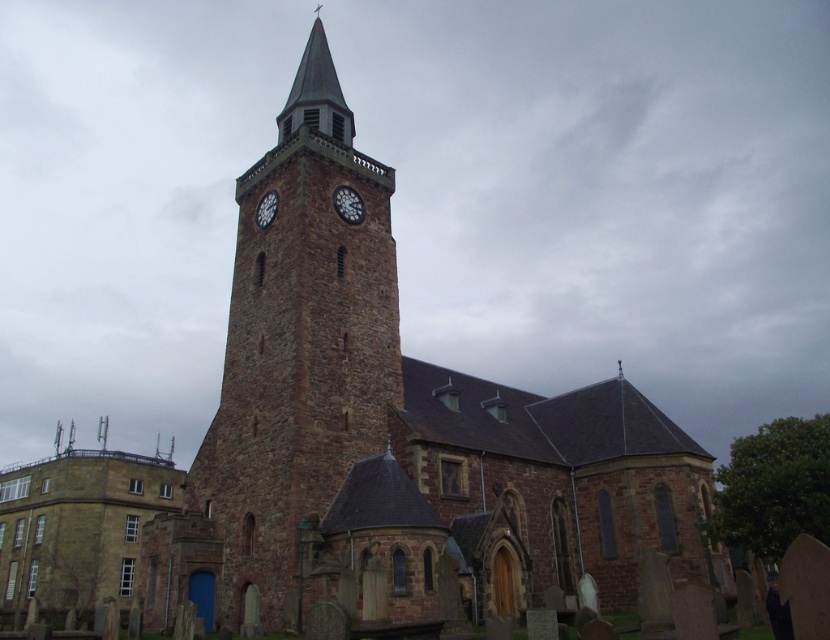
Looking at this image, you are standing in front of the historic stone church and want to take a photo that includes both the brown stone church at center and the brown stone clock tower at center. Which one should you zoom out more to include in the frame?

You should zoom out more to include the brown stone church at center because it has a larger size compared to the brown stone clock tower at center.

You are standing in front of the historic stone church and notice two clocks. The dark brown wooden clock at center and the matte brown clock at upper center. Which clock is positioned to the right of the other?

The dark brown wooden clock at center is to the right of the matte brown clock at upper center.

Based on the photo, you are standing in front of the historic stone church and want to take a photo of both point (570, 460) and point (340, 244) in the same frame. Which point should you position closer to the camera to ensure both are visible?

Point (340, 244) should be positioned closer to the camera because point (570, 460) is behind it, so adjusting the camera angle to focus on the closer point will include the one behind in the frame.